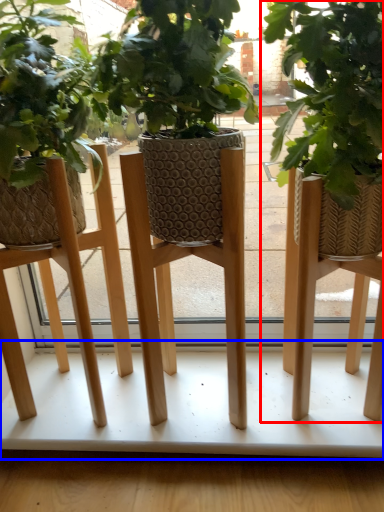
Question: Which of the following is the closest to the observer, houseplant (highlighted by a red box) or table (highlighted by a blue box)?

Choices:
 (A) houseplant
 (B) table

Answer: (A)